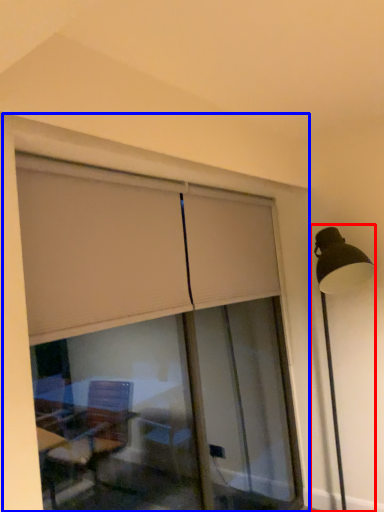
Question: Among these objects, which one is nearest to the camera, lamp post (highlighted by a red box) or window frame (highlighted by a blue box)?

Choices:
 (A) lamp post
 (B) window frame

Answer: (B)